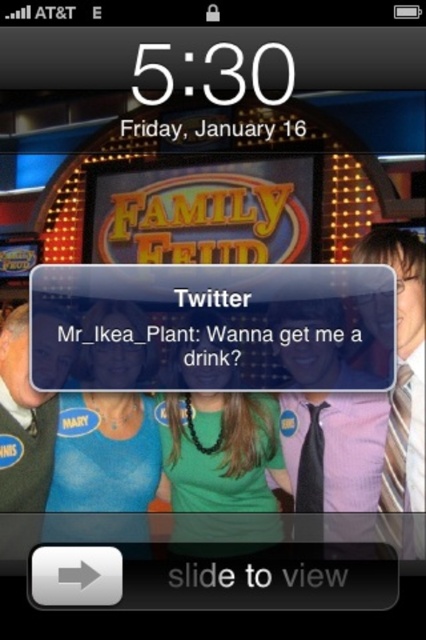
Question: Which of the following is the closest to the observer?

Choices:
 (A) (414, 472)
 (B) (301, 372)
 (C) (118, 348)
 (D) (249, 448)

Answer: (A)

Question: Can you confirm if green matte necklace at center is smaller than striped tie at right?

Choices:
 (A) yes
 (B) no

Answer: (B)

Question: Does green matte shirt at center have a greater width compared to gray sweater at left?

Choices:
 (A) no
 (B) yes

Answer: (B)

Question: Among these points, which one is nearest to the camera?

Choices:
 (A) (66, 483)
 (B) (213, 497)

Answer: (A)

Question: Does green matte necklace at center have a greater width compared to green matte shirt at center?

Choices:
 (A) no
 (B) yes

Answer: (B)

Question: Estimate the real-world distances between objects in this image. Which object is farther from the striped tie at right?

Choices:
 (A) gray sweater at left
 (B) pink fabric tie at right
 (C) green matte shirt at center
 (D) green matte necklace at center

Answer: (A)